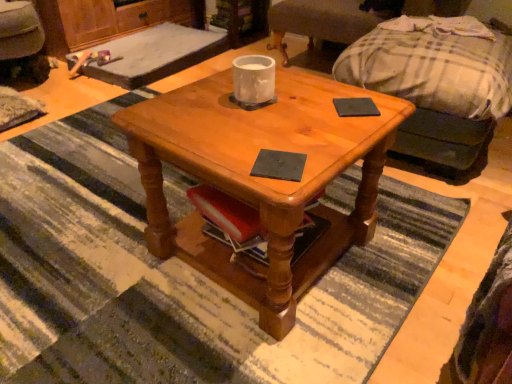
Question: Is velvet dark brown swivel chair at lower left, placed as the second swivel chair when sorted from right to left, positioned behind plaid fabric couch at upper right?

Choices:
 (A) no
 (B) yes

Answer: (B)

Question: Is velvet dark brown swivel chair at lower left, placed as the second swivel chair when sorted from right to left, wider than plaid fabric couch at upper right?

Choices:
 (A) no
 (B) yes

Answer: (B)

Question: From the image's perspective, is velvet dark brown swivel chair at lower left, placed as the second swivel chair when sorted from right to left, on plaid fabric couch at upper right?

Choices:
 (A) no
 (B) yes

Answer: (B)

Question: Does velvet dark brown swivel chair at lower left, acting as the first swivel chair starting from the left, have a lesser width compared to plaid fabric couch at upper right?

Choices:
 (A) yes
 (B) no

Answer: (B)

Question: Is velvet dark brown swivel chair at lower left, acting as the first swivel chair starting from the left, next to plaid fabric couch at upper right?

Choices:
 (A) no
 (B) yes

Answer: (A)

Question: Is plaid fabric couch at upper right inside or outside of plaid fabric swivel chair at upper right, acting as the 1th swivel chair starting from the right?

Choices:
 (A) inside
 (B) outside

Answer: (B)

Question: Considering the positions of plaid fabric couch at upper right and plaid fabric swivel chair at upper right, placed as the 2th swivel chair when sorted from left to right, in the image, is plaid fabric couch at upper right taller or shorter than plaid fabric swivel chair at upper right, placed as the 2th swivel chair when sorted from left to right,?

Choices:
 (A) tall
 (B) short

Answer: (B)

Question: Is point (492, 46) closer or farther from the camera than point (283, 16)?

Choices:
 (A) farther
 (B) closer

Answer: (B)

Question: Looking at their shapes, would you say plaid fabric couch at upper right is wider or thinner than plaid fabric swivel chair at upper right, acting as the 1th swivel chair starting from the right?

Choices:
 (A) wide
 (B) thin

Answer: (A)

Question: Is black matte pad at center, positioned as the first pad in top-to-bottom order, wider or thinner than plaid fabric couch at upper right?

Choices:
 (A) thin
 (B) wide

Answer: (A)

Question: From the image's perspective, is black matte pad at center, positioned as the 1th pad in back-to-front order, positioned above or below plaid fabric couch at upper right?

Choices:
 (A) above
 (B) below

Answer: (B)

Question: Would you say black matte pad at center, acting as the second pad starting from the bottom, is to the left or to the right of plaid fabric couch at upper right in the picture?

Choices:
 (A) right
 (B) left

Answer: (B)

Question: From their relative heights in the image, would you say black matte pad at center, positioned as the first pad in top-to-bottom order, is taller or shorter than plaid fabric couch at upper right?

Choices:
 (A) short
 (B) tall

Answer: (A)

Question: Is black matte coaster at center, the first pad viewed from the front, situated inside velvet dark brown swivel chair at lower left, placed as the second swivel chair when sorted from right to left, or outside?

Choices:
 (A) inside
 (B) outside

Answer: (B)

Question: From a real-world perspective, relative to velvet dark brown swivel chair at lower left, placed as the second swivel chair when sorted from right to left, is black matte coaster at center, which ranks as the 2th pad in top-to-bottom order, vertically above or below?

Choices:
 (A) below
 (B) above

Answer: (B)